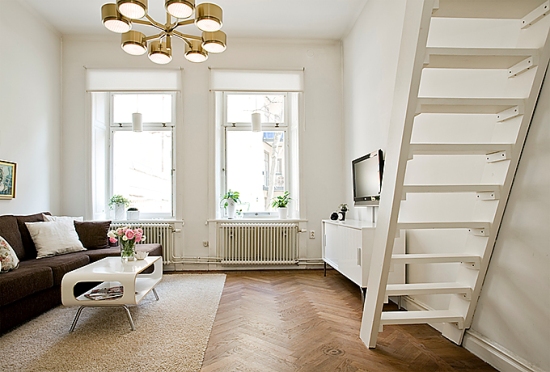
You are a GUI agent. You are given a task and a screenshot of the screen. Output one action in this format:
    pyautogui.click(x=<x>, y=<y>)
    Task: Click on the rug
    This screenshot has width=550, height=372.
    Given the screenshot: What is the action you would take?
    pyautogui.click(x=146, y=350)